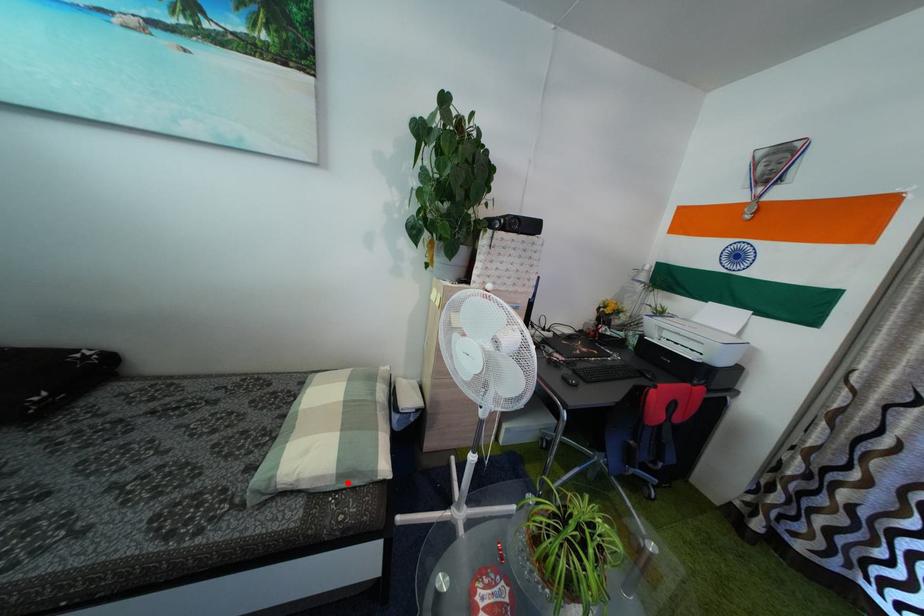
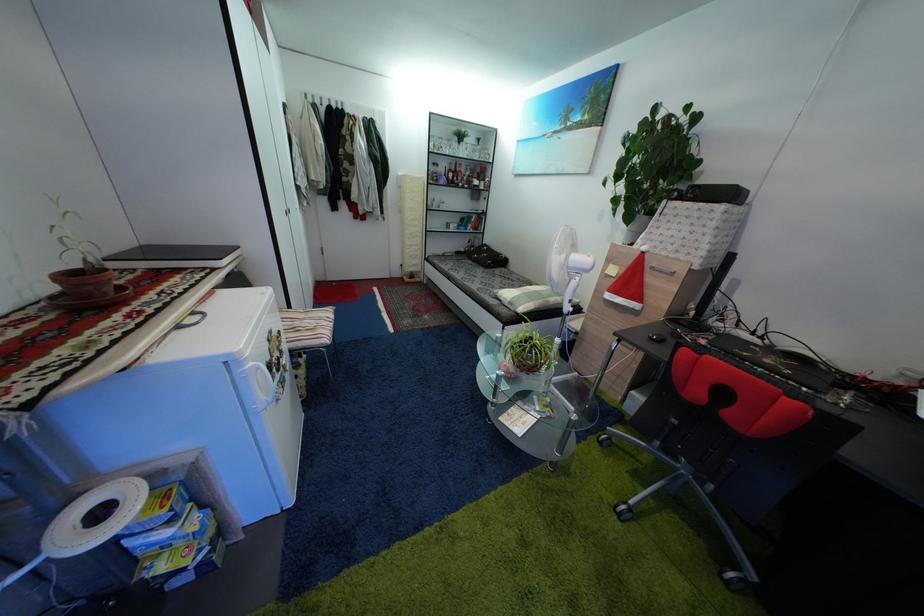
The point at the highlighted location is marked in the first image. Where is the corresponding point in the second image?

(517, 310)